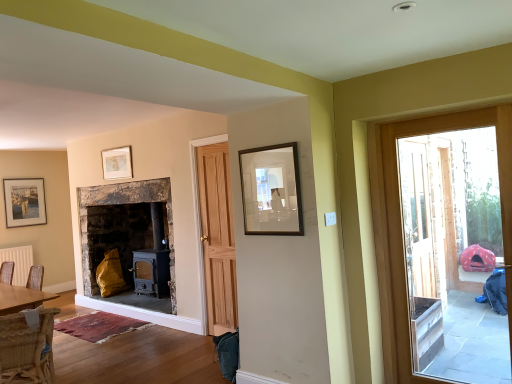
Question: Does matte gold picture frame at upper center, the second picture frame when ordered from front to back, have a smaller size compared to wooden frame at upper center, the 1th picture frame when ordered from front to back?

Choices:
 (A) no
 (B) yes

Answer: (B)

Question: Is the position of matte gold picture frame at upper center, which is counted as the 2th picture frame, starting from the right, more distant than that of wooden frame at upper center, which ranks as the first picture frame in right-to-left order?

Choices:
 (A) no
 (B) yes

Answer: (B)

Question: Is matte gold picture frame at upper center, the second picture frame when ordered from front to back, at the left side of wooden frame at upper center, the 1th picture frame when ordered from front to back?

Choices:
 (A) yes
 (B) no

Answer: (A)

Question: Is matte gold picture frame at upper center, which is counted as the 2th picture frame, starting from the right, outside wooden frame at upper center, which ranks as the first picture frame in right-to-left order?

Choices:
 (A) no
 (B) yes

Answer: (B)

Question: Is matte gold picture frame at upper center, which is counted as the 2th picture frame, starting from the right, facing away from wooden frame at upper center, acting as the 3th picture frame starting from the back?

Choices:
 (A) no
 (B) yes

Answer: (A)

Question: Does matte gold picture frame at upper center, acting as the second picture frame starting from the back, lie in front of wooden frame at upper center, the 1th picture frame when ordered from front to back?

Choices:
 (A) yes
 (B) no

Answer: (B)

Question: Can you confirm if wooden door at right is shorter than matte gold picture frame at upper center, which is the 2th picture frame from left to right?

Choices:
 (A) no
 (B) yes

Answer: (A)

Question: Is wooden door at right smaller than matte gold picture frame at upper center, which is counted as the 2th picture frame, starting from the right?

Choices:
 (A) yes
 (B) no

Answer: (B)

Question: Is wooden door at right behind matte gold picture frame at upper center, which is counted as the 2th picture frame, starting from the right?

Choices:
 (A) no
 (B) yes

Answer: (A)

Question: Does wooden door at right appear on the right side of matte gold picture frame at upper center, the second picture frame when ordered from front to back?

Choices:
 (A) no
 (B) yes

Answer: (B)

Question: From the image's perspective, is wooden door at right above matte gold picture frame at upper center, which is the 2th picture frame from left to right?

Choices:
 (A) no
 (B) yes

Answer: (A)

Question: Does wooden door at right have a greater height compared to matte gold picture frame at upper center, acting as the second picture frame starting from the back?

Choices:
 (A) no
 (B) yes

Answer: (B)

Question: Does white matte radiator at lower left have a greater width compared to wooden frame at upper center, which ranks as the first picture frame in right-to-left order?

Choices:
 (A) yes
 (B) no

Answer: (A)